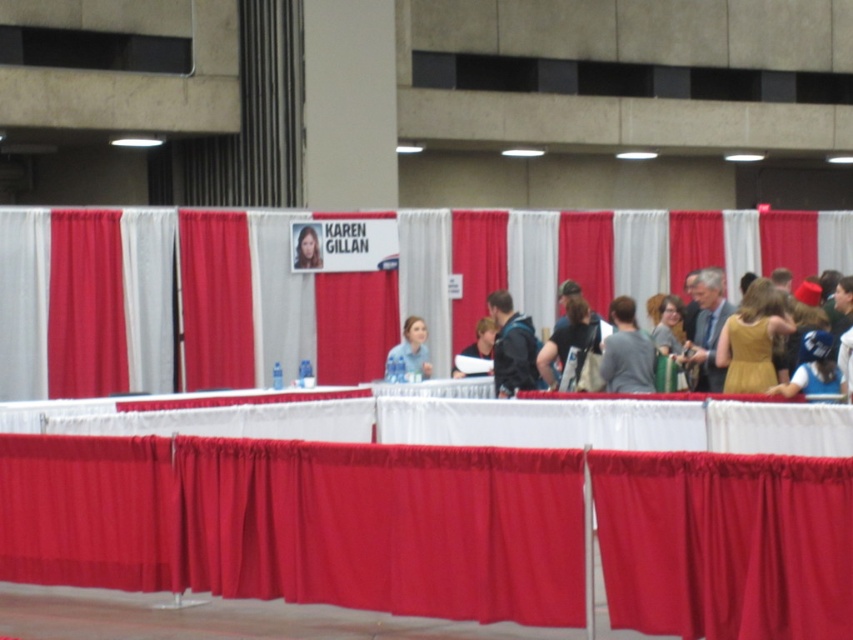
Question: Is golden satin dress at right smaller than dark blue jacket at center?

Choices:
 (A) yes
 (B) no

Answer: (B)

Question: Which is farther from the red fabric tablecloth at center?

Choices:
 (A) gray matte shirt at center
 (B) smooth skin portrait at center
 (C) blue fabric at center
 (D) blue fabric hat at right

Answer: (B)

Question: Which object is farther from the camera taking this photo?

Choices:
 (A) blue fabric hat at right
 (B) blue fabric at center
 (C) matte gold dress at center

Answer: (B)

Question: Is gray matte shirt at center thinner than matte gold dress at center?

Choices:
 (A) yes
 (B) no

Answer: (A)

Question: Does red fabric tablecloth at center appear on the left side of blue fabric at center?

Choices:
 (A) no
 (B) yes

Answer: (B)

Question: Which object is closer to the camera taking this photo?

Choices:
 (A) matte black jacket at center
 (B) dark brown leather jacket at center
 (C) red fabric tablecloth at center

Answer: (C)